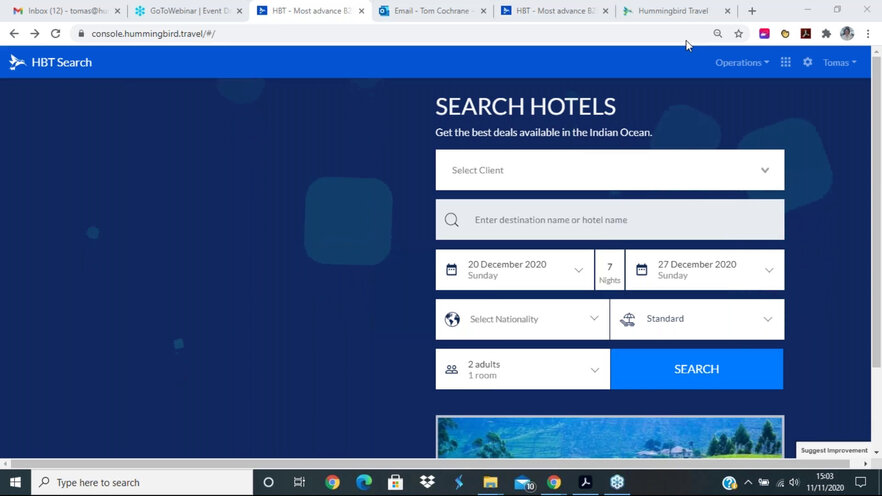
Identify the location of globe. The height and width of the screenshot is (496, 882). (456, 320).